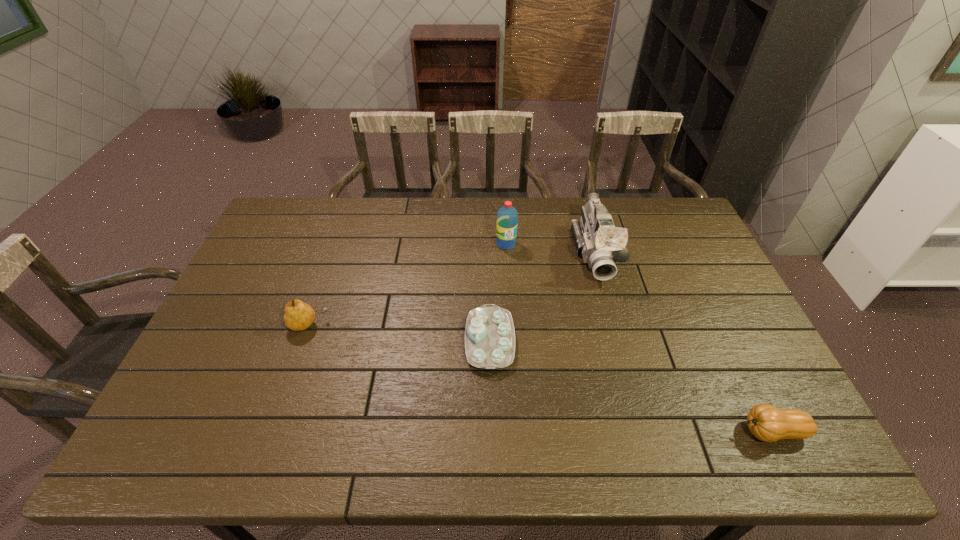
Locate an element on the screen. camcorder is located at coordinates (596, 238).

At what (x,y) coordinates should I click in order to perform the action: click on water bottle. Please return your answer as a coordinate pair (x, y). The width and height of the screenshot is (960, 540). Looking at the image, I should click on (507, 216).

Locate an element on the screen. Image resolution: width=960 pixels, height=540 pixels. pear is located at coordinates (298, 316).

Locate an element on the screen. This screenshot has width=960, height=540. the leftmost object is located at coordinates (298, 316).

In order to click on chinaware in this screenshot , I will do `click(489, 333)`.

At what (x,y) coordinates should I click in order to perform the action: click on the rightmost object. Please return your answer as a coordinate pair (x, y). The width and height of the screenshot is (960, 540). Looking at the image, I should click on (766, 422).

Identify the location of gourd. The height and width of the screenshot is (540, 960). 766,422.

The width and height of the screenshot is (960, 540). I want to click on free region located 0.130m on the front-facing side of the camcorder, so click(612, 318).

The width and height of the screenshot is (960, 540). I want to click on free space located on the front label of the second tallest object, so click(x=508, y=278).

The width and height of the screenshot is (960, 540). Find the location of `vacant space situated 0.210m on the right of the pear`. vacant space situated 0.210m on the right of the pear is located at coordinates (402, 325).